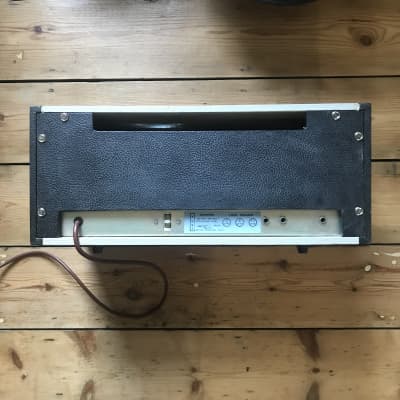
Where is `shadow on wood plank`? shadow on wood plank is located at coordinates pos(177,281).